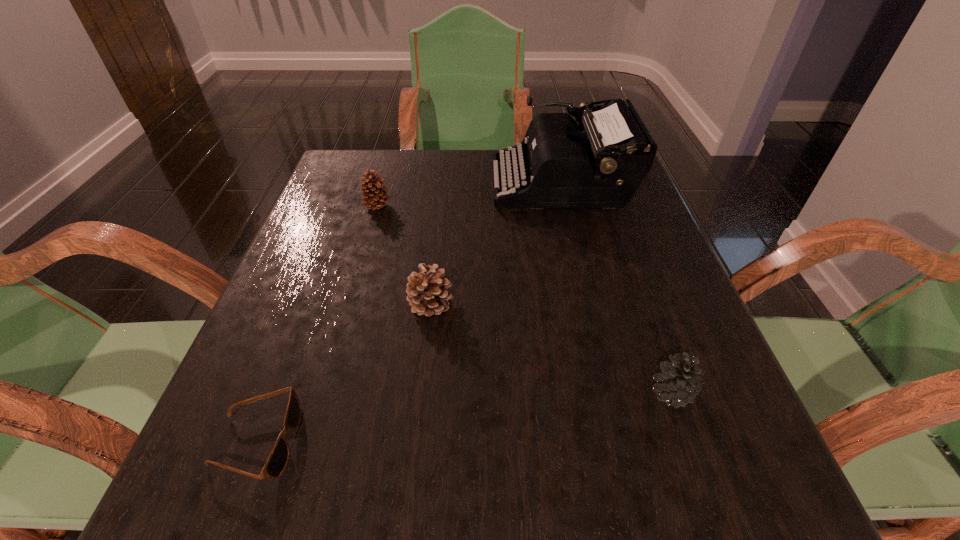
Locate an element on the screen. Image resolution: width=960 pixels, height=540 pixels. typewriter is located at coordinates (564, 167).

Where is `the leftmost pinecone`? the leftmost pinecone is located at coordinates (374, 199).

Image resolution: width=960 pixels, height=540 pixels. I want to click on the third farthest object, so click(427, 292).

The image size is (960, 540). Identify the location of the third object from left to right. (427, 292).

You are a GUI agent. You are given a task and a screenshot of the screen. Output one action in this format:
    pyautogui.click(x=<x>, y=<y>)
    Task: Click on the nearest pinecone
    
    Given the screenshot: What is the action you would take?
    pyautogui.click(x=679, y=383)

I want to click on the shortest object, so click(278, 458).

Locate an element on the screen. blank area located 0.270m on the typing side of the tallest object is located at coordinates (383, 183).

This screenshot has height=540, width=960. I want to click on free space located on the typing side of the tallest object, so click(x=347, y=183).

What are the coordinates of `vacant space located 0.320m on the typing side of the tallest object` in the screenshot? It's located at (362, 183).

In order to click on vacant space positioned on the back of the farthest pinecone in this screenshot , I will do `click(394, 151)`.